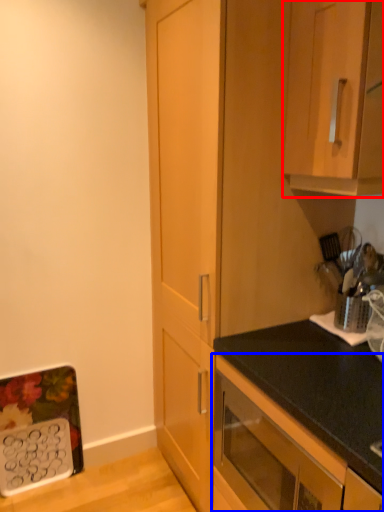
Question: Which object is closer to the camera taking this photo, cabinetry (highlighted by a red box) or cabinetry (highlighted by a blue box)?

Choices:
 (A) cabinetry
 (B) cabinetry

Answer: (B)